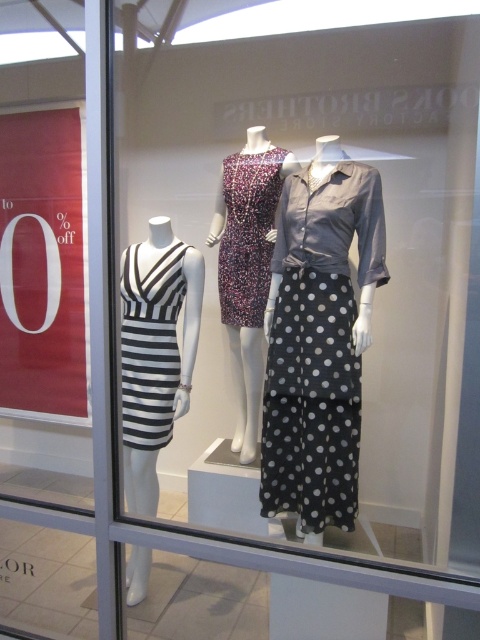
Question: Which of these objects is positioned closest to the printed fabric dress at center?

Choices:
 (A) black and white striped dress at left
 (B) gray polka dot skirt at center
 (C) sparkly purple dress at center
 (D) black striped dress at left

Answer: (C)

Question: Is gray polka dot skirt at center bigger than printed fabric dress at center?

Choices:
 (A) no
 (B) yes

Answer: (A)

Question: Is black and white striped dress at left thinner than sparkly purple dress at center?

Choices:
 (A) yes
 (B) no

Answer: (B)

Question: Is the position of gray polka dot skirt at center less distant than that of black and white striped dress at left?

Choices:
 (A) yes
 (B) no

Answer: (B)

Question: Which point appears farthest from the camera in this image?

Choices:
 (A) (147, 502)
 (B) (122, 419)
 (C) (271, 320)

Answer: (A)

Question: Which of the following is the closest to the observer?

Choices:
 (A) (152, 296)
 (B) (350, 440)
 (C) (167, 285)

Answer: (B)